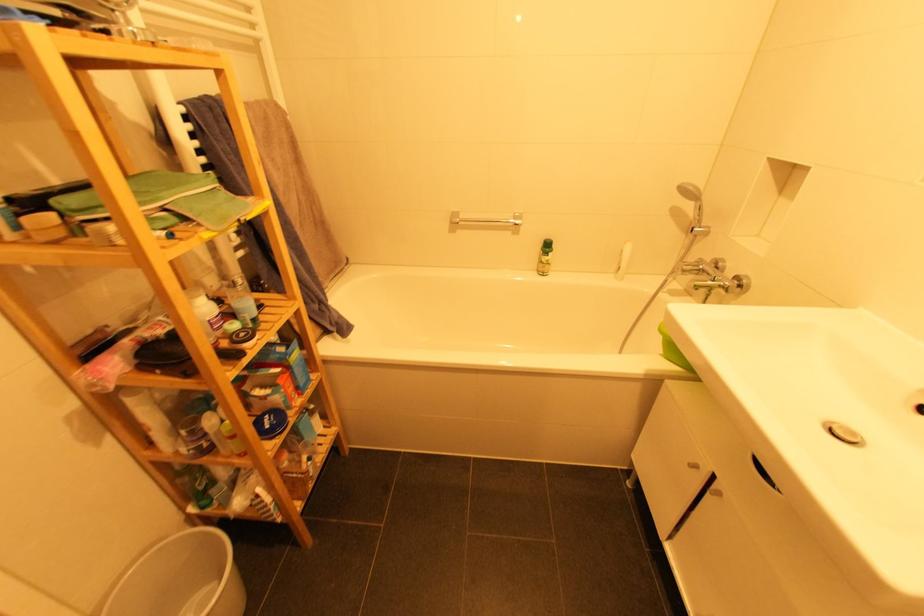
Identify the location of chrome shower head. tap(695, 207).